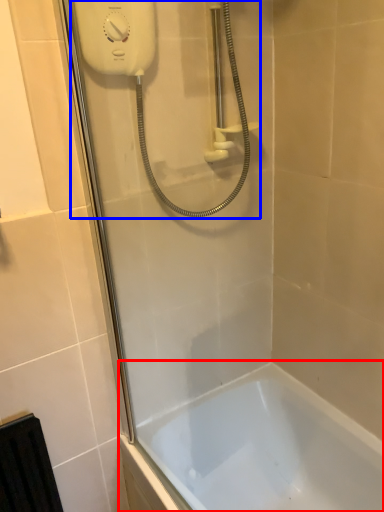
Question: Which point is further to the camera, bathtub (highlighted by a red box) or shower (highlighted by a blue box)?

Choices:
 (A) bathtub
 (B) shower

Answer: (A)